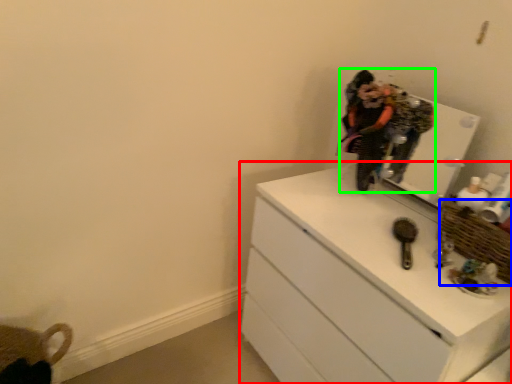
Question: Based on their relative distances, which object is farther from chest of drawers (highlighted by a red box)? Choose from basket (highlighted by a blue box) and person (highlighted by a green box).

Choices:
 (A) basket
 (B) person

Answer: (B)